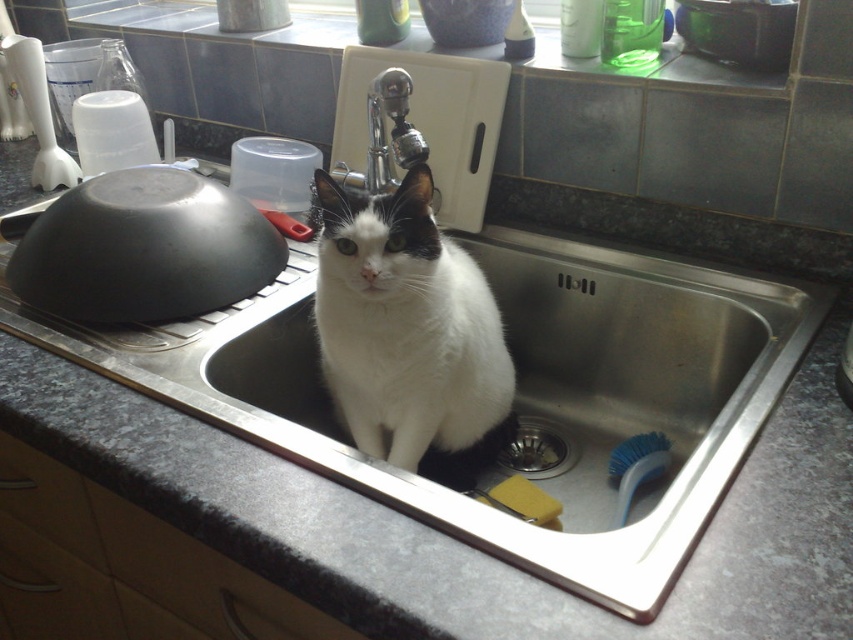
You are a plumber inspecting the kitchen sink area. You need to replace the polished chrome faucet at upper center and the brushed metal sink at lower center. Given their sizes, which one will require a larger workspace?

The polished chrome faucet at upper center has a larger size compared to the brushed metal sink at lower center, so it will require a larger workspace.

You are a plumber inspecting the kitchen sink area. You need to locate the faucet to check for leaks. According to the image, where is the polished chrome faucet at upper center in relation to the brushed metal sink at lower center?

The polished chrome faucet at upper center is located above the brushed metal sink at lower center.

You are a chef preparing to wash dishes and need to move the matte black bowl at left out of the way. Since the polished chrome faucet at upper center is in the way, can you slide the bowl towards the right without hitting the faucet?

The matte black bowl at left is closer to the viewer than the polished chrome faucet at upper center, so sliding it towards the right would not interfere with the faucet since it is positioned in front of it.